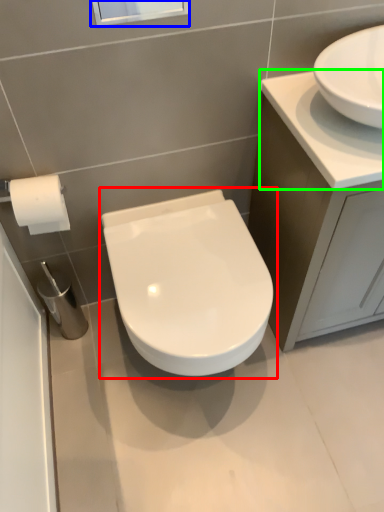
Question: Which object is positioned closest to toilet (highlighted by a red box)? Select from window screen (highlighted by a blue box) and counter top (highlighted by a green box).

Choices:
 (A) window screen
 (B) counter top

Answer: (B)